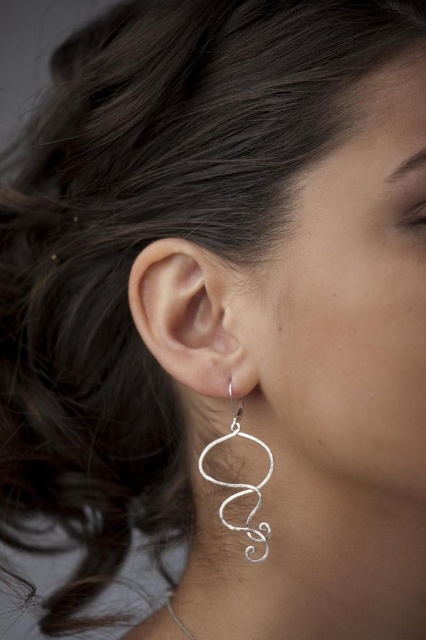
Which of these two, silver wire earring at center or silver wire earring at lower left, stands shorter?

silver wire earring at center is shorter.

From the picture: Who is lower down, silver wire earring at center or silver wire earring at lower left?

silver wire earring at lower left is lower down.

What do you see at coordinates (193, 317) in the screenshot? Image resolution: width=426 pixels, height=640 pixels. I see `silver wire earring at center` at bounding box center [193, 317].

This screenshot has width=426, height=640. In order to click on silver wire earring at center in this screenshot , I will do click(x=193, y=317).

Measure the distance from silver wire earring at center to silver wire necklace at lower center.

silver wire earring at center and silver wire necklace at lower center are 10.17 inches apart from each other.

Describe the element at coordinates (193, 317) in the screenshot. I see `silver wire earring at center` at that location.

You are a GUI agent. You are given a task and a screenshot of the screen. Output one action in this format:
    pyautogui.click(x=<x>, y=<y>)
    Task: Click on the silver wire earring at center
    
    Given the screenshot: What is the action you would take?
    pyautogui.click(x=193, y=317)

Does silver wire earring at lower left have a larger size compared to silver wire necklace at lower center?

Actually, silver wire earring at lower left might be smaller than silver wire necklace at lower center.

Does point (268, 480) lie behind point (180, 627)?

No, (268, 480) is closer to viewer.

Is point (207, 452) more distant than point (178, 618)?

No, it is in front of (178, 618).

Locate an element on the screen. The width and height of the screenshot is (426, 640). silver wire earring at lower left is located at coordinates (241, 486).